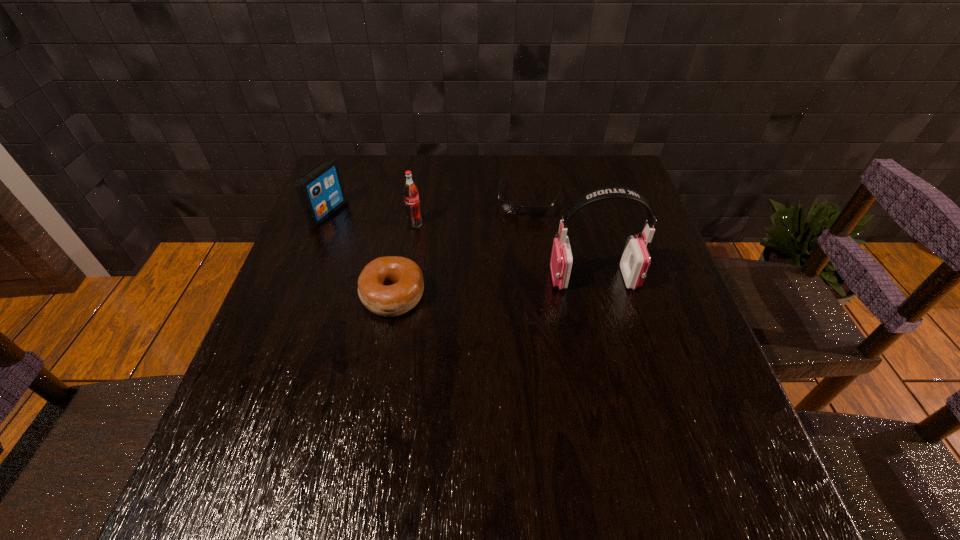
This screenshot has height=540, width=960. Find the location of `sunglasses present at the far edge`. sunglasses present at the far edge is located at coordinates (511, 208).

You are a GUI agent. You are given a task and a screenshot of the screen. Output one action in this format:
    pyautogui.click(x=<x>, y=<y>)
    Task: Click on the object that is positioned at the left edge
    
    Given the screenshot: What is the action you would take?
    pyautogui.click(x=320, y=191)

I want to click on object present at the right edge, so click(x=635, y=261).

Where is `object that is at the far left corner`? The width and height of the screenshot is (960, 540). object that is at the far left corner is located at coordinates (320, 191).

Identify the location of free point at the far edge. (468, 184).

Where is `vacant area at the near edge`? The height and width of the screenshot is (540, 960). vacant area at the near edge is located at coordinates (545, 438).

Identify the location of blank space at the left edge of the desktop. (x=319, y=298).

Image resolution: width=960 pixels, height=540 pixels. I want to click on vacant space at the right edge of the desktop, so click(x=695, y=347).

I want to click on vacant area at the far left corner, so click(369, 171).

At what (x,y) coordinates should I click in order to perform the action: click on blank space at the near left corner of the desktop. Please return your answer as a coordinate pair (x, y). Image resolution: width=960 pixels, height=540 pixels. Looking at the image, I should click on tap(308, 411).